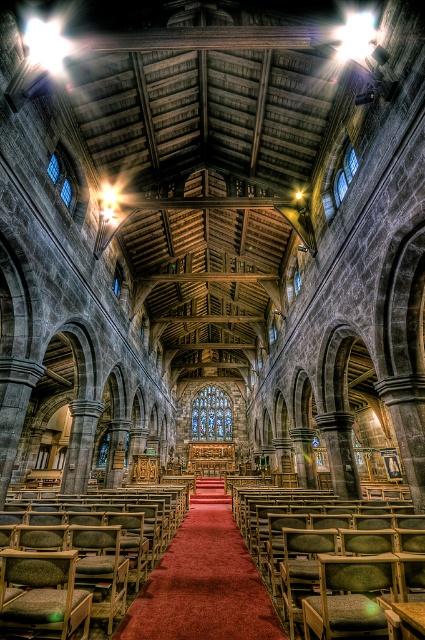
You are a tour guide leading a group through the church. You want to point out the clear glass window at upper left to your visitors from your current position at the carpeted aisle at center. Is the window within your line of sight? Please explain your reasoning.

The distance between the carpeted aisle at center and the clear glass window at upper left is 66.86 meters. Since this distance is quite large, the window might be too far away to be clearly seen from the carpeted aisle at center. However, the clear glass window at upper left could still be within line of sight if there are no obstructions like pillars or structures blocking the view. The high ceiling and open layout of the church might allow for a clear line of sight despite the distance.

You are an event planner organizing a procession that requires a wide path. You see the carpeted aisle at center and the clear glass window at upper left. Which one has a greater width?

The carpeted aisle at center has a greater width than the clear glass window at upper left, as its width surpasses that of the window.

You are standing at the entrance of the grand church and want to find the clear glass window at upper left. Which direction should you look to see it from the carpeted aisle at center?

The clear glass window at upper left is located above the carpeted aisle at center, so you should look upward from the carpeted aisle at center to see it.